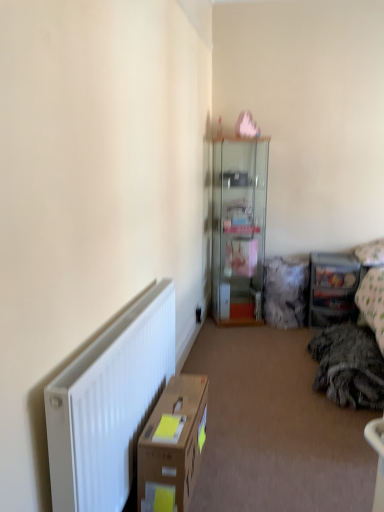
Question: From the image's perspective, is brown cardboard box at lower left below clear plastic storage at right?

Choices:
 (A) no
 (B) yes

Answer: (B)

Question: Is brown cardboard box at lower left with clear plastic storage at right?

Choices:
 (A) yes
 (B) no

Answer: (B)

Question: Is brown cardboard box at lower left behind clear plastic storage at right?

Choices:
 (A) yes
 (B) no

Answer: (B)

Question: Are brown cardboard box at lower left and clear plastic storage at right located far from each other?

Choices:
 (A) yes
 (B) no

Answer: (A)

Question: Is brown cardboard box at lower left not within clear plastic storage at right?

Choices:
 (A) yes
 (B) no

Answer: (A)

Question: Is brown cardboard box at lower left to the left of clear plastic storage at right from the viewer's perspective?

Choices:
 (A) no
 (B) yes

Answer: (B)

Question: Is transparent glass cabinet at upper center closer to the viewer compared to white matte radiator at lower left?

Choices:
 (A) yes
 (B) no

Answer: (B)

Question: Considering the relative sizes of transparent glass cabinet at upper center and white matte radiator at lower left in the image provided, is transparent glass cabinet at upper center taller than white matte radiator at lower left?

Choices:
 (A) yes
 (B) no

Answer: (A)

Question: From the image's perspective, is transparent glass cabinet at upper center on white matte radiator at lower left?

Choices:
 (A) yes
 (B) no

Answer: (A)

Question: Is transparent glass cabinet at upper center bigger than white matte radiator at lower left?

Choices:
 (A) yes
 (B) no

Answer: (A)

Question: Is transparent glass cabinet at upper center not near white matte radiator at lower left?

Choices:
 (A) yes
 (B) no

Answer: (A)

Question: Does transparent glass cabinet at upper center have a smaller size compared to white matte radiator at lower left?

Choices:
 (A) no
 (B) yes

Answer: (A)

Question: Is clear plastic storage at right oriented towards white matte radiator at lower left?

Choices:
 (A) no
 (B) yes

Answer: (A)